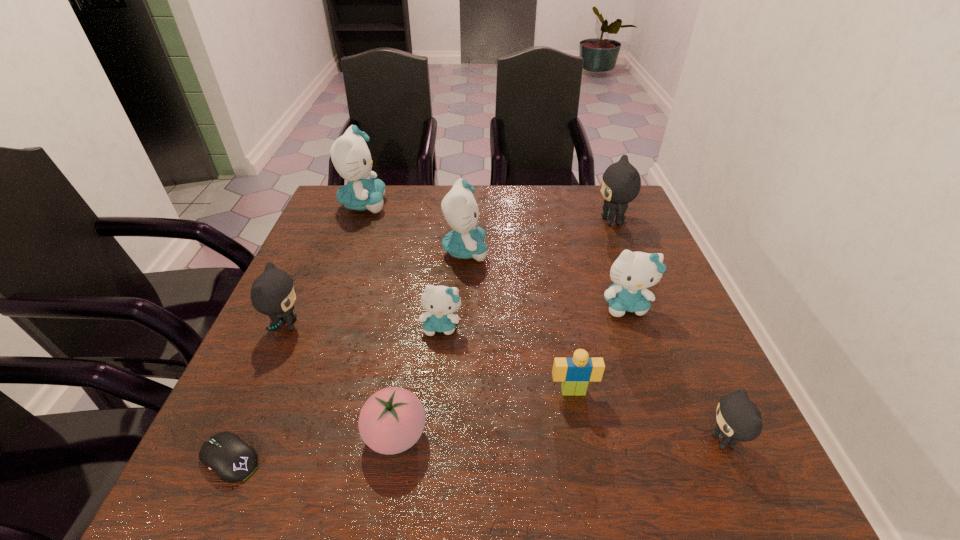
Find the location of `the tallest object`. the tallest object is located at coordinates (350, 155).

Where is `the farthest blue kitten`? the farthest blue kitten is located at coordinates (350, 155).

At what (x,y) coordinates should I click in order to perform the action: click on the third smallest blue kitten. Please return your answer as a coordinate pair (x, y). Looking at the image, I should click on (459, 207).

Identify the location of the farthest gray kitten. (621, 182).

Identify the location of the third biggest blue kitten. (632, 272).

This screenshot has width=960, height=540. I want to click on the leftmost gray kitten, so click(273, 293).

Where is `the second farthest gray kitten`? The height and width of the screenshot is (540, 960). the second farthest gray kitten is located at coordinates (273, 293).

Locate an element on the screen. This screenshot has height=540, width=960. the smallest blue kitten is located at coordinates (440, 302).

Identify the location of the fourth nearest object. (575, 372).

In order to click on beige Lego in this screenshot , I will do `click(575, 372)`.